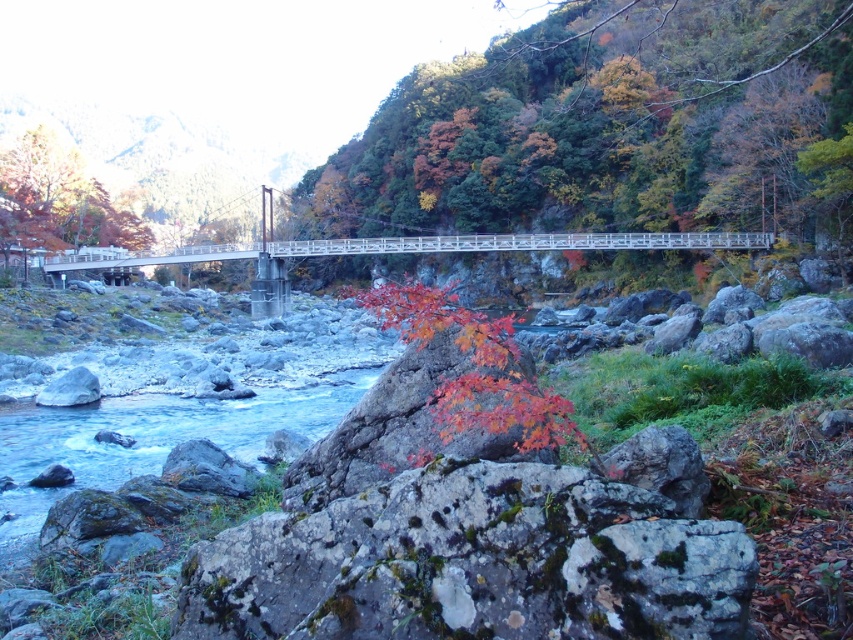
Which is more to the left, mossy gray rock at center or white wooden bridge at center?

white wooden bridge at center is more to the left.

Who is more forward, [213,609] or [654,240]?

Point [213,609] is more forward.

Find the location of a particular element. mossy gray rock at center is located at coordinates (473, 563).

Is mossy gray rock at center below smooth gray rock at lower left?

Actually, mossy gray rock at center is above smooth gray rock at lower left.

Is the position of mossy gray rock at center more distant than that of smooth gray rock at lower left?

That is False.

Is point (595, 620) behind point (49, 403)?

No, (595, 620) is in front of (49, 403).

The height and width of the screenshot is (640, 853). I want to click on mossy gray rock at center, so click(x=473, y=563).

Based on the photo, does mossy gray rock at center have a lesser height compared to autumn leaves at upper left?

Correct, mossy gray rock at center is not as tall as autumn leaves at upper left.

Is mossy gray rock at center taller than autumn leaves at upper left?

Incorrect, mossy gray rock at center's height is not larger of autumn leaves at upper left's.

Where is `mossy gray rock at center`? This screenshot has width=853, height=640. mossy gray rock at center is located at coordinates (473, 563).